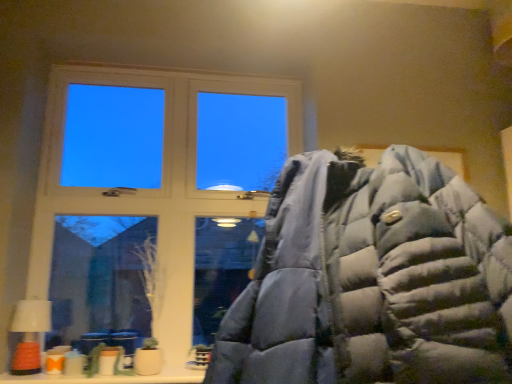
Question: Is orange matte lampshade at lower left closer to camera compared to matte blue puffer jacket at center?

Choices:
 (A) yes
 (B) no

Answer: (B)

Question: Are orange matte lampshade at lower left and matte blue puffer jacket at center beside each other?

Choices:
 (A) yes
 (B) no

Answer: (B)

Question: Considering the relative positions of orange matte lampshade at lower left and matte blue puffer jacket at center in the image provided, is orange matte lampshade at lower left to the right of matte blue puffer jacket at center from the viewer's perspective?

Choices:
 (A) no
 (B) yes

Answer: (A)

Question: Is orange matte lampshade at lower left positioned with its back to matte blue puffer jacket at center?

Choices:
 (A) no
 (B) yes

Answer: (A)

Question: Considering the relative sizes of orange matte lampshade at lower left and matte blue puffer jacket at center in the image provided, is orange matte lampshade at lower left smaller than matte blue puffer jacket at center?

Choices:
 (A) yes
 (B) no

Answer: (A)

Question: From the image's perspective, is white wood window at upper left located above or below orange matte lampshade at lower left?

Choices:
 (A) above
 (B) below

Answer: (A)

Question: From a real-world perspective, relative to orange matte lampshade at lower left, is white wood window at upper left vertically above or below?

Choices:
 (A) below
 (B) above

Answer: (B)

Question: Is white wood window at upper left bigger or smaller than orange matte lampshade at lower left?

Choices:
 (A) small
 (B) big

Answer: (B)

Question: Is white wood window at upper left taller or shorter than orange matte lampshade at lower left?

Choices:
 (A) short
 (B) tall

Answer: (B)

Question: From a real-world perspective, relative to white wood window at upper left, is orange matte lampshade at lower left vertically above or below?

Choices:
 (A) above
 (B) below

Answer: (B)

Question: From the image's perspective, is orange matte lampshade at lower left above or below white wood window at upper left?

Choices:
 (A) below
 (B) above

Answer: (A)

Question: From their relative heights in the image, would you say orange matte lampshade at lower left is taller or shorter than white wood window at upper left?

Choices:
 (A) short
 (B) tall

Answer: (A)

Question: In terms of width, does orange matte lampshade at lower left look wider or thinner when compared to white wood window at upper left?

Choices:
 (A) wide
 (B) thin

Answer: (A)

Question: From the image's perspective, is orange matte lampshade at lower left located above or below matte blue puffer jacket at center?

Choices:
 (A) below
 (B) above

Answer: (A)

Question: Considering the positions of orange matte lampshade at lower left and matte blue puffer jacket at center in the image, is orange matte lampshade at lower left wider or thinner than matte blue puffer jacket at center?

Choices:
 (A) thin
 (B) wide

Answer: (A)